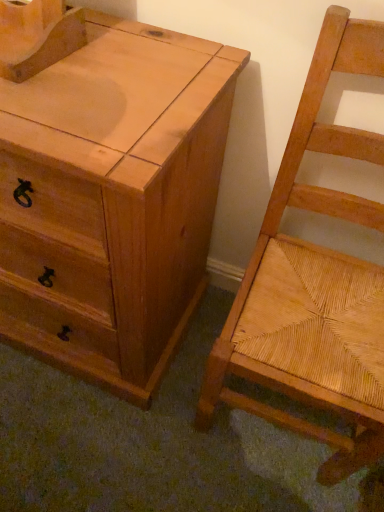
In order to click on natural wood chest of drawers at left in this screenshot , I will do `click(112, 198)`.

What do you see at coordinates (112, 198) in the screenshot? I see `natural wood chest of drawers at left` at bounding box center [112, 198].

I want to click on natural wood woven seat at right, so click(314, 281).

What do you see at coordinates (314, 281) in the screenshot?
I see `natural wood woven seat at right` at bounding box center [314, 281].

Image resolution: width=384 pixels, height=512 pixels. Find the location of `natural wood chest of drawers at left`. natural wood chest of drawers at left is located at coordinates point(112,198).

Visually, is natural wood woven seat at right positioned to the left or to the right of natural wood chest of drawers at left?

In the image, natural wood woven seat at right appears on the right side of natural wood chest of drawers at left.

Which object is further away from the camera, natural wood woven seat at right or natural wood chest of drawers at left?

natural wood chest of drawers at left is further from the camera.

Which is more distant, (x=371, y=310) or (x=70, y=198)?

The point (x=371, y=310) is farther from the camera.

Consider the image. From the image's perspective, is natural wood woven seat at right below natural wood chest of drawers at left?

Indeed, from the image's perspective, natural wood woven seat at right is shown beneath natural wood chest of drawers at left.

From a real-world perspective, which object rests below the other?

In real-world perspective, natural wood chest of drawers at left is lower.

In terms of width, does natural wood woven seat at right look wider or thinner when compared to natural wood chest of drawers at left?

Considering their sizes, natural wood woven seat at right looks slimmer than natural wood chest of drawers at left.

Can you confirm if natural wood woven seat at right is shorter than natural wood chest of drawers at left?

No.

Between natural wood woven seat at right and natural wood chest of drawers at left, which one has larger size?

Bigger between the two is natural wood chest of drawers at left.

Would you say natural wood woven seat at right is outside natural wood chest of drawers at left?

That's correct, natural wood woven seat at right is outside of natural wood chest of drawers at left.

Is natural wood woven seat at right not close to natural wood chest of drawers at left?

natural wood woven seat at right is actually quite close to natural wood chest of drawers at left.

Is natural wood woven seat at right oriented away from natural wood chest of drawers at left?

No, natural wood chest of drawers at left is not at the back of natural wood woven seat at right.

Can you tell me how much natural wood woven seat at right and natural wood chest of drawers at left differ in facing direction?

They differ by 0.0712 degrees in their facing directions.

You are a GUI agent. You are given a task and a screenshot of the screen. Output one action in this format:
    pyautogui.click(x=<x>, y=<y>)
    Task: Click on the chair lying below the natural wood chest of drawers at left (from the image's perspective)
    This screenshot has width=384, height=512.
    Given the screenshot: What is the action you would take?
    pyautogui.click(x=314, y=281)

Consider the image. Which object is positioned more to the right, natural wood chest of drawers at left or natural wood woven seat at right?

natural wood woven seat at right is more to the right.

Which object is closer to the camera taking this photo, natural wood chest of drawers at left or natural wood woven seat at right?

natural wood woven seat at right is more forward.

Between point (197, 153) and point (298, 360), which one is positioned behind?

The point (298, 360) is farther.

Looking at this image, from the image's perspective, is natural wood chest of drawers at left under natural wood woven seat at right?

Actually, natural wood chest of drawers at left appears above natural wood woven seat at right in the image.

From a real-world perspective, relative to natural wood woven seat at right, is natural wood chest of drawers at left vertically above or below?

In terms of real-world spatial position, natural wood chest of drawers at left is below natural wood woven seat at right.

Which of these two, natural wood chest of drawers at left or natural wood woven seat at right, is wider?

With larger width is natural wood chest of drawers at left.

In terms of height, does natural wood chest of drawers at left look taller or shorter compared to natural wood woven seat at right?

natural wood chest of drawers at left is shorter than natural wood woven seat at right.

Is natural wood chest of drawers at left bigger than natural wood woven seat at right?

Yes.

Can natural wood woven seat at right be found inside natural wood chest of drawers at left?

No, natural wood woven seat at right is not inside natural wood chest of drawers at left.

Are natural wood chest of drawers at left and natural wood woven seat at right far apart?

No.

Is natural wood chest of drawers at left positioned with its back to natural wood woven seat at right?

natural wood chest of drawers at left is not turned away from natural wood woven seat at right.

This screenshot has width=384, height=512. I want to click on chair on the right of natural wood chest of drawers at left, so click(x=314, y=281).

In order to click on chair on the right of natural wood chest of drawers at left in this screenshot , I will do `click(314, 281)`.

The width and height of the screenshot is (384, 512). Identify the location of the chest of drawers that is above the natural wood woven seat at right (from the image's perspective). (112, 198).